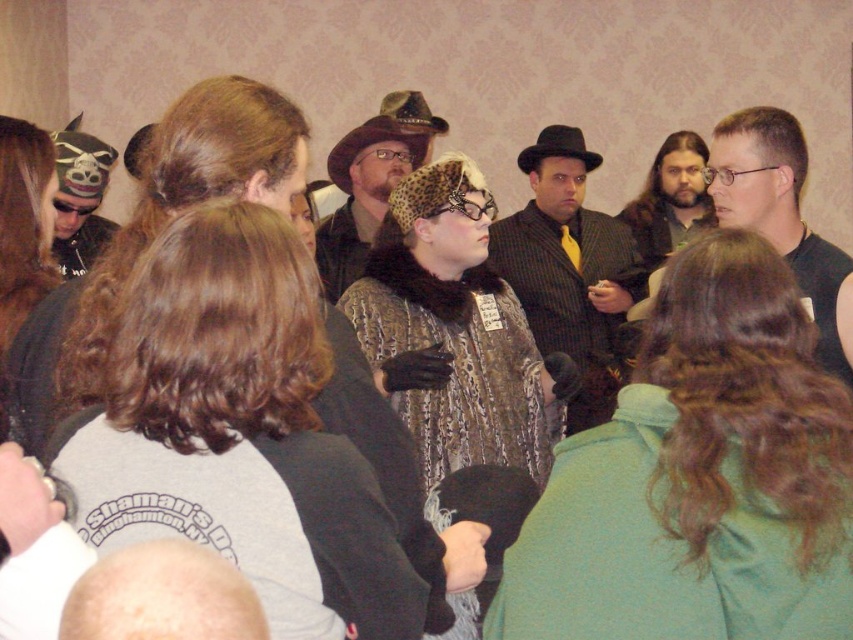
Does black matte shirt at right have a greater height compared to leather cowboy hat at center?

Yes.

Is black matte shirt at right smaller than leather cowboy hat at center?

Yes.

Does point (788, 131) come farther from viewer compared to point (381, 129)?

No, (788, 131) is in front of (381, 129).

The image size is (853, 640). In order to click on black matte shirt at right in this screenshot , I will do `click(782, 216)`.

Who is shorter, striped suit coat at center or leather cowboy hat at center?

With less height is leather cowboy hat at center.

Is striped suit coat at center bigger than leather cowboy hat at center?

Yes, striped suit coat at center is bigger than leather cowboy hat at center.

Who is more distant from viewer, [630,250] or [403,113]?

The point [403,113] is behind.

In order to click on striped suit coat at center in this screenshot , I will do `click(569, 268)`.

Between point (343, 141) and point (598, 154), which one is positioned behind?

Positioned behind is point (598, 154).

Between leather cowboy hat at center and black felt cowboy hat at center, which one appears on the left side from the viewer's perspective?

Positioned to the left is leather cowboy hat at center.

Locate an element on the screen. The width and height of the screenshot is (853, 640). leather cowboy hat at center is located at coordinates (387, 132).